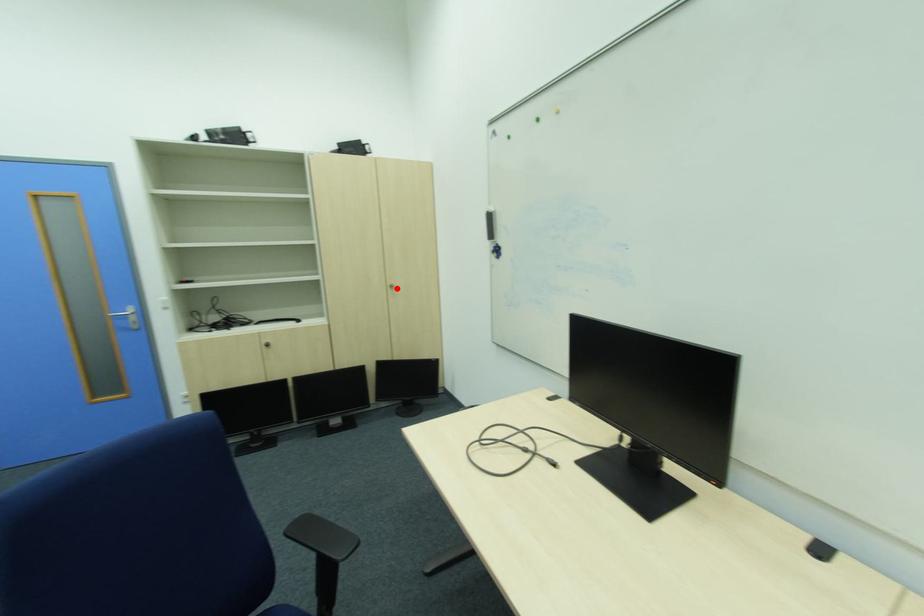
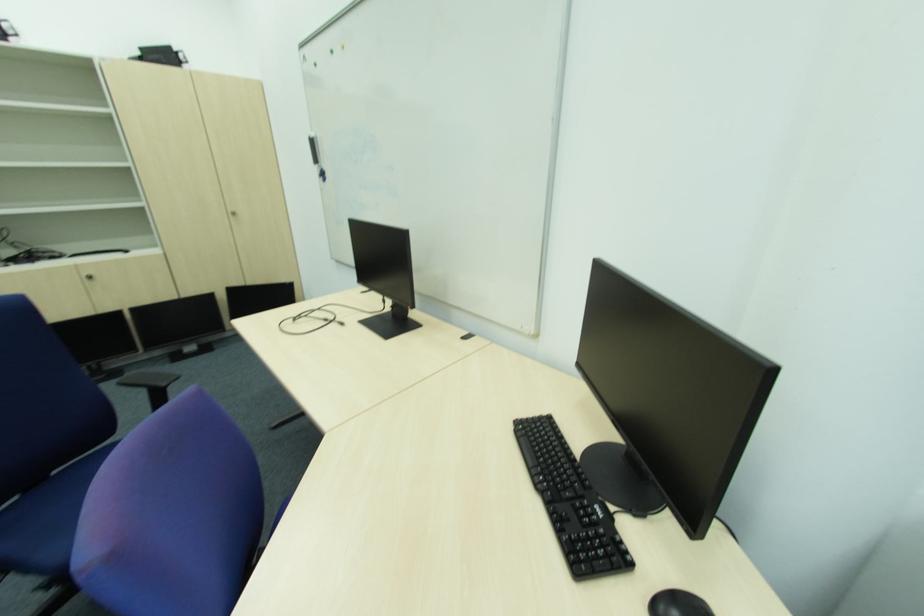
Find the pixel in the second image that matches the highlighted location in the first image.

(237, 217)